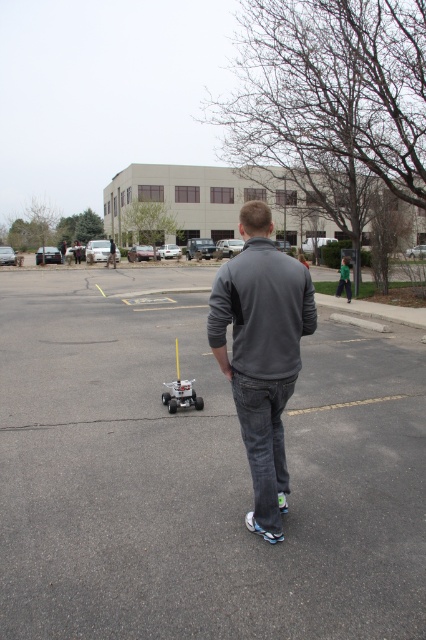
Can you confirm if white plastic toy at center is thinner than silver metallic toy car at center?

Yes.

Does point (198, 396) lie behind point (189, 394)?

Yes, point (198, 396) is behind point (189, 394).

Is point (175, 406) positioned before point (169, 394)?

That is True.

The height and width of the screenshot is (640, 426). Find the location of `white plastic toy at center`. white plastic toy at center is located at coordinates (181, 392).

Consider the image. Between gray fleece jacket at center and silver metallic toy car at center, which one has less height?

Standing shorter between the two is gray fleece jacket at center.

From the picture: Can you confirm if gray fleece jacket at center is smaller than silver metallic toy car at center?

Indeed, gray fleece jacket at center has a smaller size compared to silver metallic toy car at center.

Describe the element at coordinates (261, 353) in the screenshot. I see `gray fleece jacket at center` at that location.

This screenshot has width=426, height=640. In order to click on gray fleece jacket at center in this screenshot , I will do `click(261, 353)`.

Who is more forward, (11, 332) or (198, 401)?

Point (198, 401) is in front.

Measure the distance between gray asphalt parking lot at center and camera.

They are 9.81 feet apart.

Who is more forward, (311,369) or (180,388)?

Point (180,388) is more forward.

I want to click on gray asphalt parking lot at center, so click(x=198, y=472).